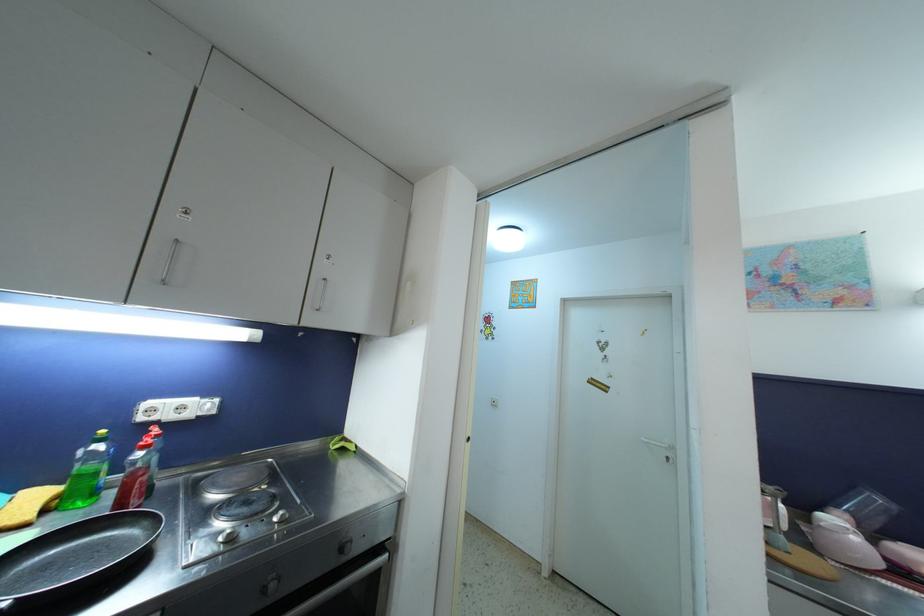
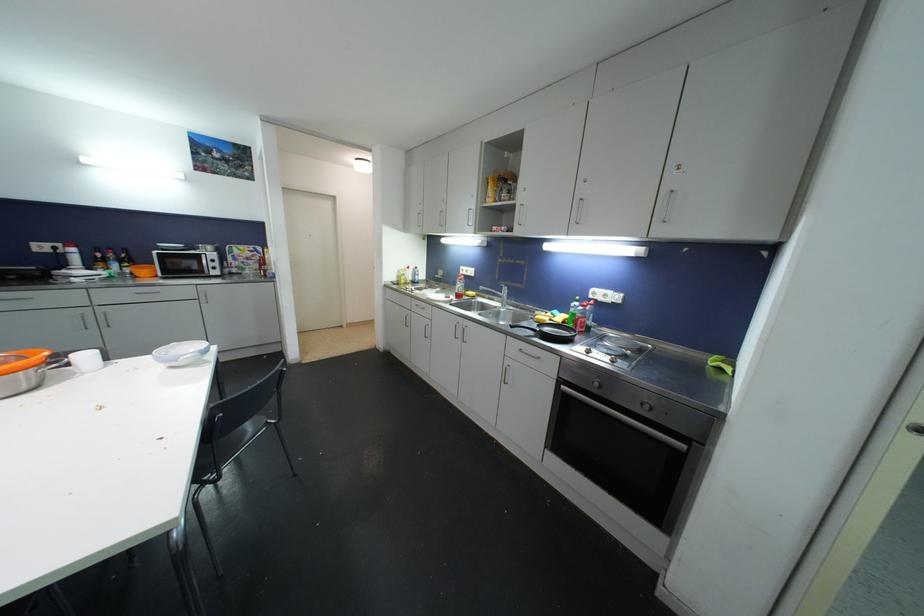
Locate, in the second image, the point that corresponds to (x=345, y=553) in the first image.

(646, 407)